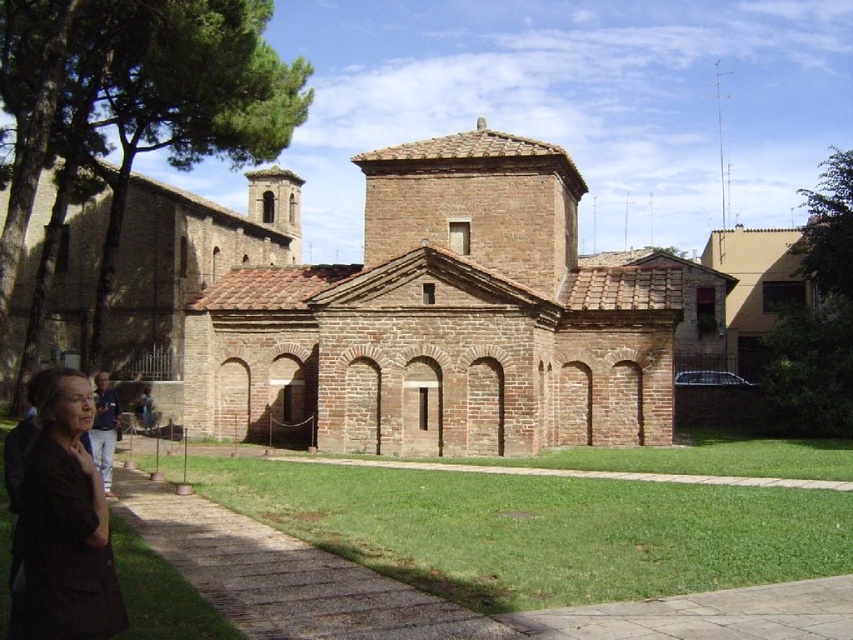
Is the position of brown brick chapel at center less distant than that of dark brown fabric at lower left?

No.

Which is behind, point (605, 362) or point (96, 612)?

The point (605, 362) is more distant.

This screenshot has width=853, height=640. I want to click on brown brick chapel at center, so click(444, 320).